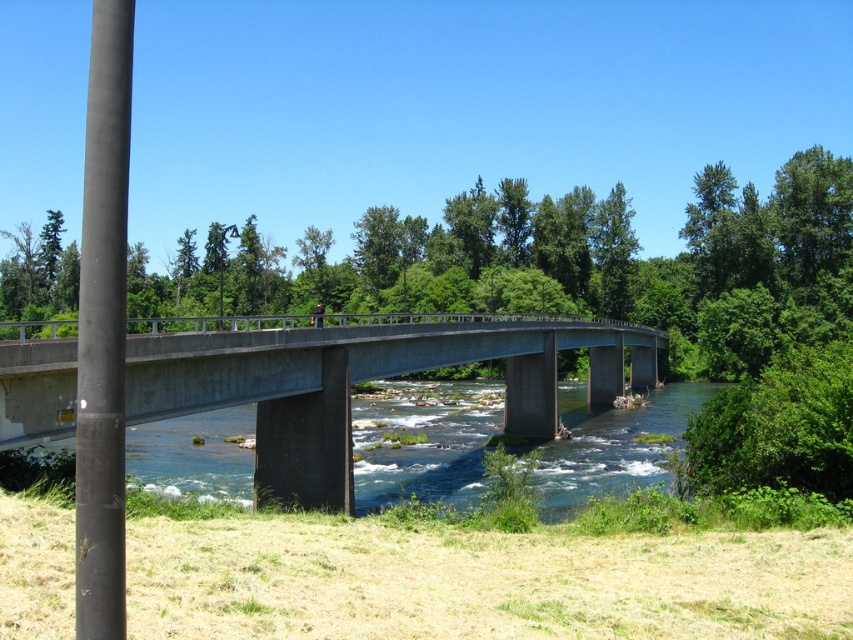
Question: Considering the relative positions of concrete bridge at center and smooth black pole at left in the image provided, where is concrete bridge at center located with respect to smooth black pole at left?

Choices:
 (A) left
 (B) right

Answer: (B)

Question: Does concrete bridge at center appear under smooth black pole at left?

Choices:
 (A) no
 (B) yes

Answer: (B)

Question: Which of the following is the closest to the observer?

Choices:
 (A) smooth black pole at left
 (B) concrete bridge at center

Answer: (A)

Question: Considering the relative positions of concrete bridge at center and smooth black pole at left in the image provided, where is concrete bridge at center located with respect to smooth black pole at left?

Choices:
 (A) below
 (B) above

Answer: (A)